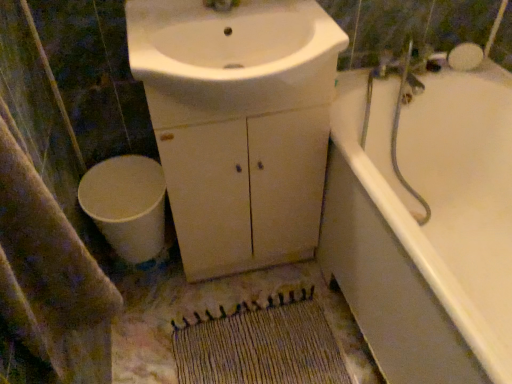
You are a GUI agent. You are given a task and a screenshot of the screen. Output one action in this format:
    pyautogui.click(x=<x>, y=<y>)
    Task: Click on the vacant space situated on the left part of woven beige mat at lower center
    
    Given the screenshot: What is the action you would take?
    pyautogui.click(x=157, y=328)